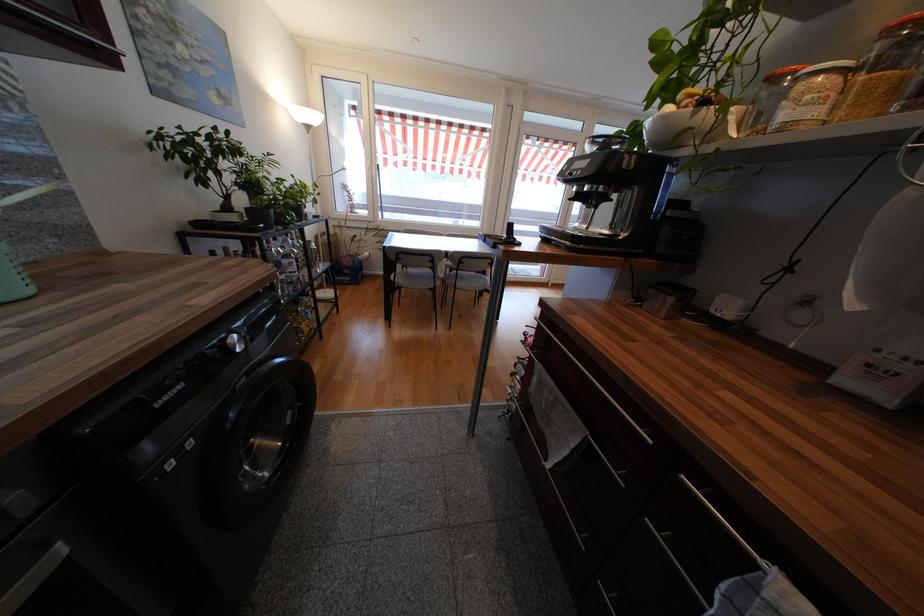
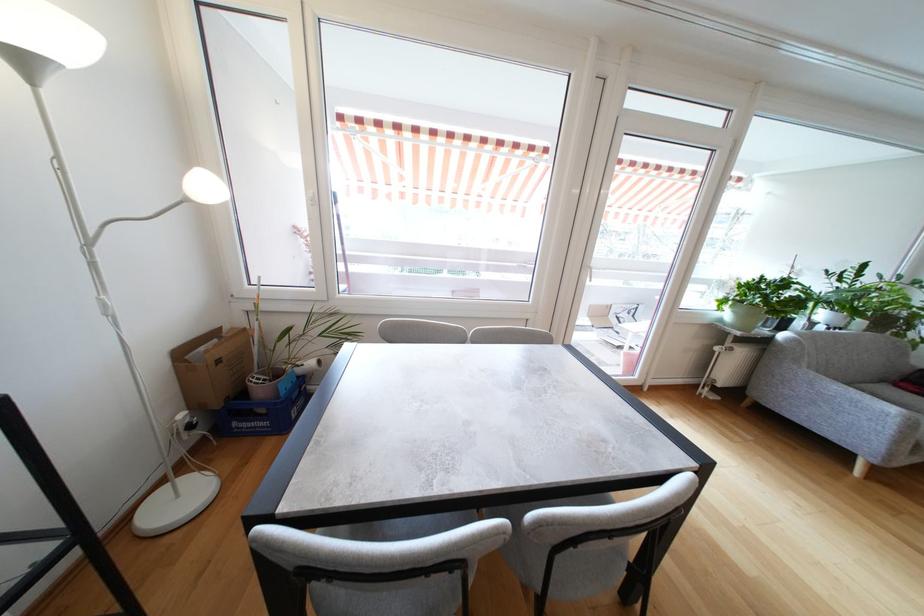
Question: I am providing you with two images of the same scene from different viewpoints. Which of the following objects are not visible in image2?

Choices:
 (A) terracotta plant pot
 (B) white plant pot
 (C) sofa armrest
 (D) none of these

Answer: (D)